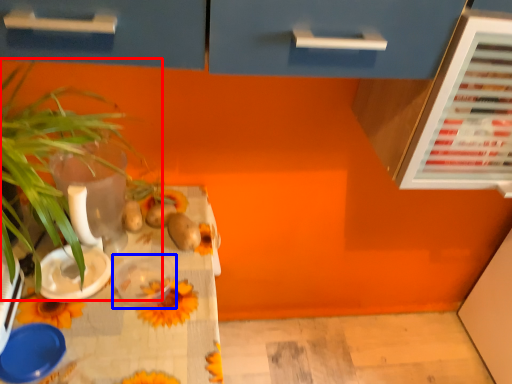
Question: Which object appears closest to the camera in this image, houseplant (highlighted by a red box) or tableware (highlighted by a blue box)?

Choices:
 (A) houseplant
 (B) tableware

Answer: (A)